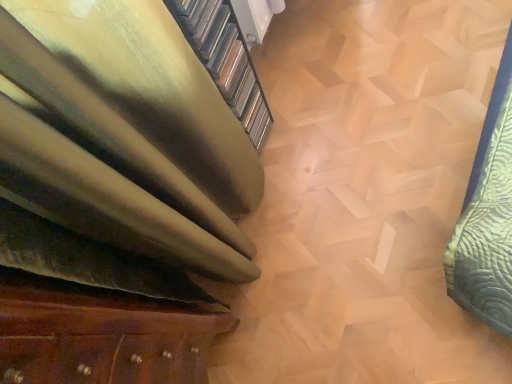
Question: Based on their positions, is gold textured stairwell at upper left located to the left or right of wooden drawer at lower left?

Choices:
 (A) right
 (B) left

Answer: (A)

Question: Considering their positions, is gold textured stairwell at upper left located in front of or behind wooden drawer at lower left?

Choices:
 (A) front
 (B) behind

Answer: (B)

Question: Based on their sizes in the image, would you say gold textured stairwell at upper left is bigger or smaller than wooden drawer at lower left?

Choices:
 (A) big
 (B) small

Answer: (B)

Question: Is point (35, 324) closer or farther from the camera than point (241, 112)?

Choices:
 (A) closer
 (B) farther

Answer: (A)

Question: Is wooden drawer at lower left inside the boundaries of gold textured stairwell at upper left, or outside?

Choices:
 (A) inside
 (B) outside

Answer: (B)

Question: In terms of size, does wooden drawer at lower left appear bigger or smaller than gold textured stairwell at upper left?

Choices:
 (A) small
 (B) big

Answer: (B)

Question: In terms of width, does wooden drawer at lower left look wider or thinner when compared to gold textured stairwell at upper left?

Choices:
 (A) wide
 (B) thin

Answer: (A)